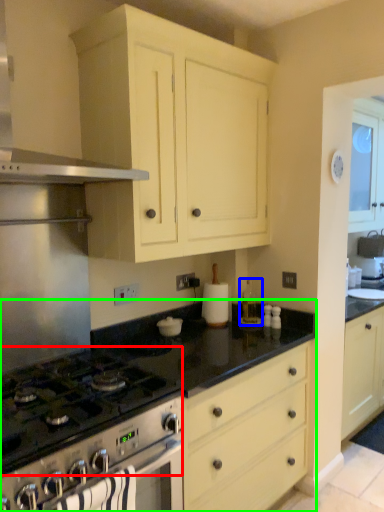
Question: Estimate the real-world distances between objects in this image. Which object is farther from gas stove (highlighted by a red box), appliance (highlighted by a blue box) or countertop (highlighted by a green box)?

Choices:
 (A) appliance
 (B) countertop

Answer: (A)